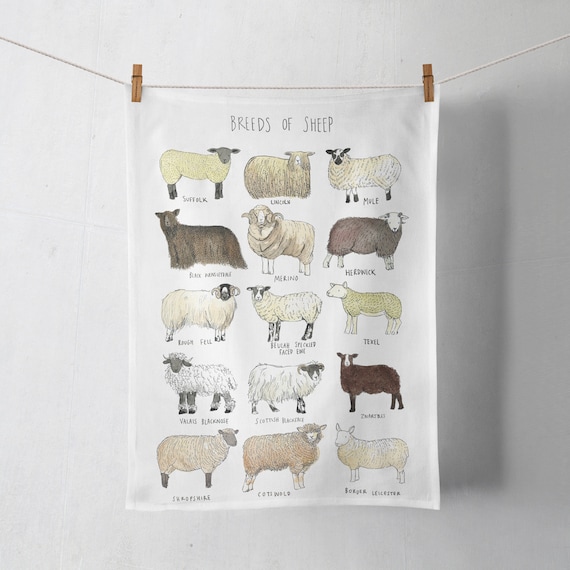
Identify the location of white wall. (78, 504).